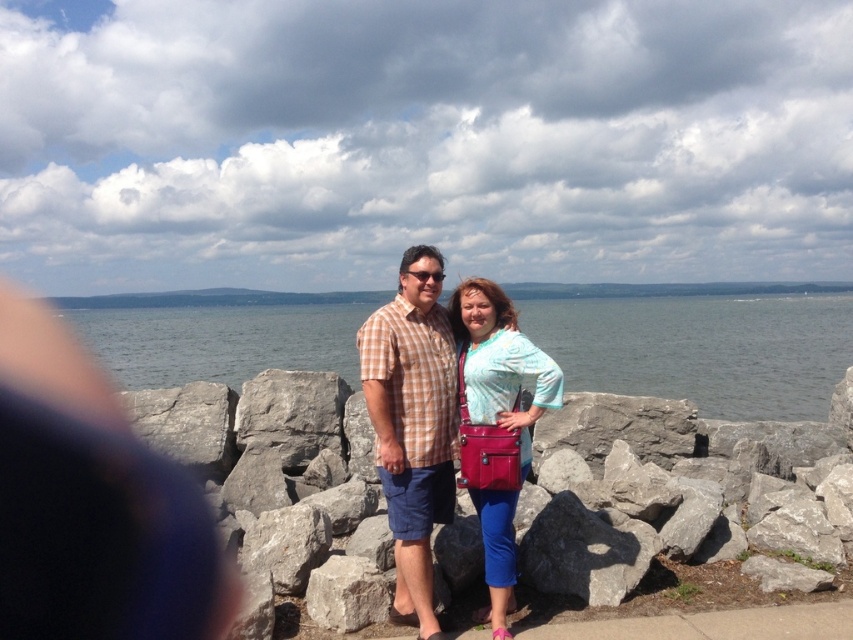
You are a GUI agent. You are given a task and a screenshot of the screen. Output one action in this format:
    pyautogui.click(x=<x>, y=<y>)
    Task: Click on the gray water at center
    
    Given the screenshot: What is the action you would take?
    pyautogui.click(x=701, y=349)

Who is more distant from viewer, (743, 342) or (492, 468)?

Point (743, 342)

Where is `gray water at center`? The height and width of the screenshot is (640, 853). gray water at center is located at coordinates (701, 349).

Between gray water at center and checkered fabric shirt at center, which one has less height?

checkered fabric shirt at center

From the picture: Which is more to the right, gray water at center or checkered fabric shirt at center?

checkered fabric shirt at center

Where is `gray water at center`? This screenshot has height=640, width=853. gray water at center is located at coordinates (701, 349).

Find the location of a particular element. The height and width of the screenshot is (640, 853). gray water at center is located at coordinates (701, 349).

Can you confirm if checkered fabric shirt at center is wider than matte pink purse at center?

No.

Consider the image. Which of these two, checkered fabric shirt at center or matte pink purse at center, stands taller?

matte pink purse at center

Between point (408, 602) and point (488, 509), which one is positioned behind?

The point (408, 602) is more distant.

Image resolution: width=853 pixels, height=640 pixels. What are the coordinates of `checkered fabric shirt at center` in the screenshot? It's located at coord(412,424).